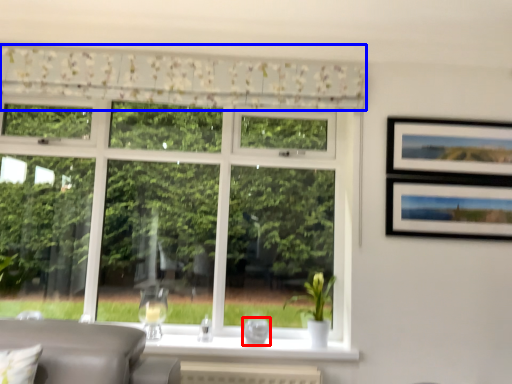
Question: Which point is further to the camera, glass vase (highlighted by a red box) or curtain (highlighted by a blue box)?

Choices:
 (A) glass vase
 (B) curtain

Answer: (A)